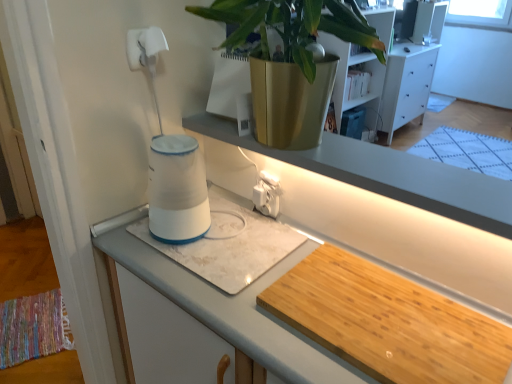
The width and height of the screenshot is (512, 384). In order to click on empty space that is ontop of wooden cutting board at lower right, which is the 2th wide from left to right (from a real-world perspective) in this screenshot , I will do `click(388, 313)`.